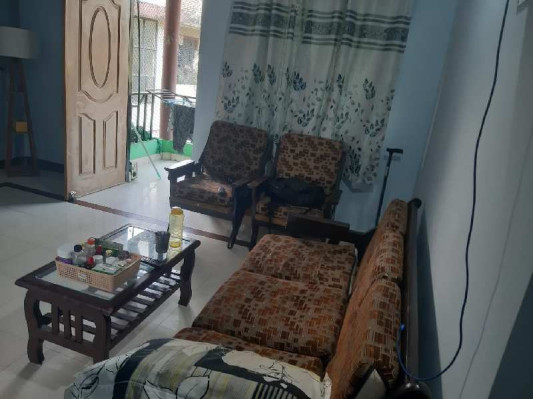
Find the location of a particular element. This screenshot has height=399, width=533. cord hanging down wall is located at coordinates (476, 150).